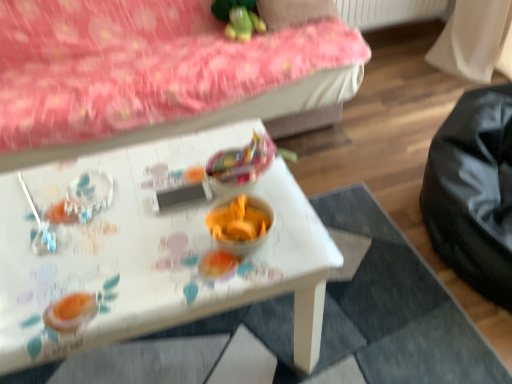
Question: Is pink fabric pillow at upper center positioned in front of white glossy table at center?

Choices:
 (A) no
 (B) yes

Answer: (A)

Question: Is pink fabric pillow at upper center at the left side of white glossy table at center?

Choices:
 (A) yes
 (B) no

Answer: (B)

Question: From a real-world perspective, is pink fabric pillow at upper center under white glossy table at center?

Choices:
 (A) no
 (B) yes

Answer: (A)

Question: Is there a large distance between pink fabric pillow at upper center and white glossy table at center?

Choices:
 (A) no
 (B) yes

Answer: (B)

Question: Can you confirm if pink fabric pillow at upper center is wider than white glossy table at center?

Choices:
 (A) no
 (B) yes

Answer: (A)

Question: From a real-world perspective, is green plush toy at upper center above or below pink fabric pillow at upper center?

Choices:
 (A) below
 (B) above

Answer: (B)

Question: Considering the positions of green plush toy at upper center and pink fabric pillow at upper center in the image, is green plush toy at upper center bigger or smaller than pink fabric pillow at upper center?

Choices:
 (A) big
 (B) small

Answer: (B)

Question: Is point (x=240, y=21) positioned closer to the camera than point (x=316, y=0)?

Choices:
 (A) farther
 (B) closer

Answer: (B)

Question: Based on their positions, is green plush toy at upper center located to the left or right of pink fabric pillow at upper center?

Choices:
 (A) left
 (B) right

Answer: (A)

Question: Is point (290, 233) positioned closer to the camera than point (222, 163)?

Choices:
 (A) closer
 (B) farther

Answer: (A)

Question: From a real-world perspective, is white glossy table at center physically located above or below shiny plastic candy at center?

Choices:
 (A) below
 (B) above

Answer: (A)

Question: Is white glossy table at center inside or outside of shiny plastic candy at center?

Choices:
 (A) outside
 (B) inside

Answer: (A)

Question: In terms of height, does white glossy table at center look taller or shorter compared to shiny plastic candy at center?

Choices:
 (A) tall
 (B) short

Answer: (A)

Question: Considering the positions of white glossy table at center and green plush toy at upper center in the image, is white glossy table at center taller or shorter than green plush toy at upper center?

Choices:
 (A) short
 (B) tall

Answer: (B)

Question: In terms of width, does white glossy table at center look wider or thinner when compared to green plush toy at upper center?

Choices:
 (A) thin
 (B) wide

Answer: (B)